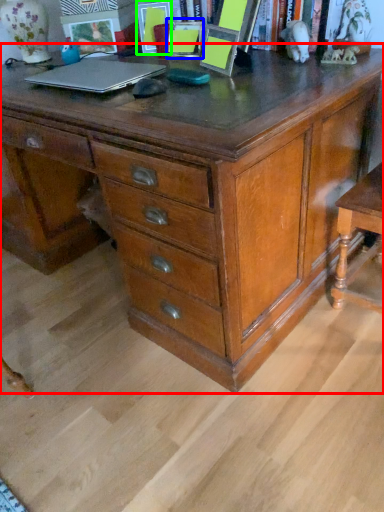
Question: Estimate the real-world distances between objects in this image. Which object is closer to chest of drawers (highlighted by a red box), picture frame (highlighted by a blue box) or picture frame (highlighted by a green box)?

Choices:
 (A) picture frame
 (B) picture frame

Answer: (A)